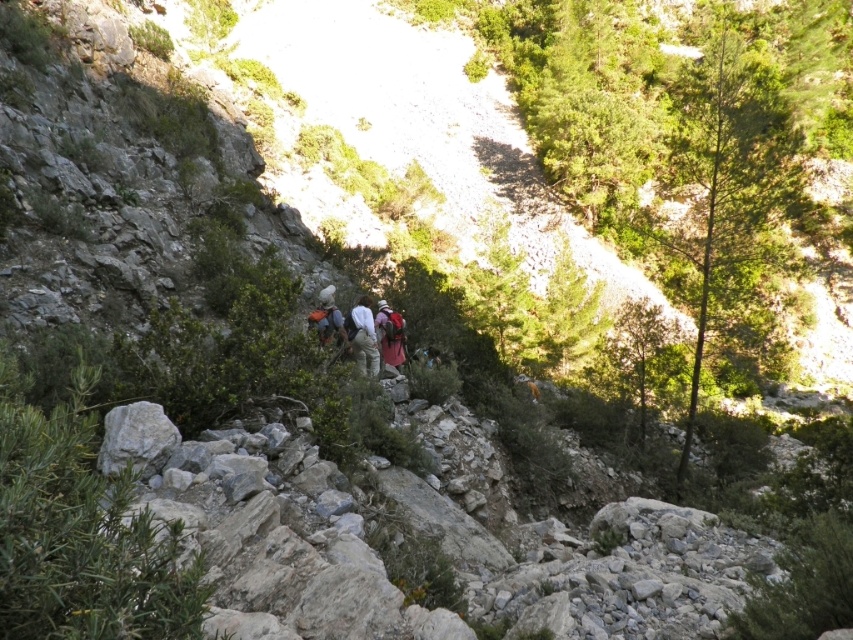
Question: Is camouflage fabric backpack at center smaller than matte orange backpack at center?

Choices:
 (A) no
 (B) yes

Answer: (A)

Question: Is white fabric backpack at center thinner than camouflage fabric backpack at center?

Choices:
 (A) no
 (B) yes

Answer: (A)

Question: Among these points, which one is nearest to the camera?

Choices:
 (A) (386, 320)
 (B) (366, 365)

Answer: (B)

Question: Is white fabric backpack at center to the right of camouflage fabric backpack at center from the viewer's perspective?

Choices:
 (A) no
 (B) yes

Answer: (A)

Question: Which point is closer to the camera?

Choices:
 (A) camouflage fabric backpack at center
 (B) white fabric backpack at center
 (C) matte orange backpack at center

Answer: (B)

Question: Estimate the real-world distances between objects in this image. Which object is farther from the white fabric backpack at center?

Choices:
 (A) matte orange backpack at center
 (B) camouflage fabric backpack at center

Answer: (B)